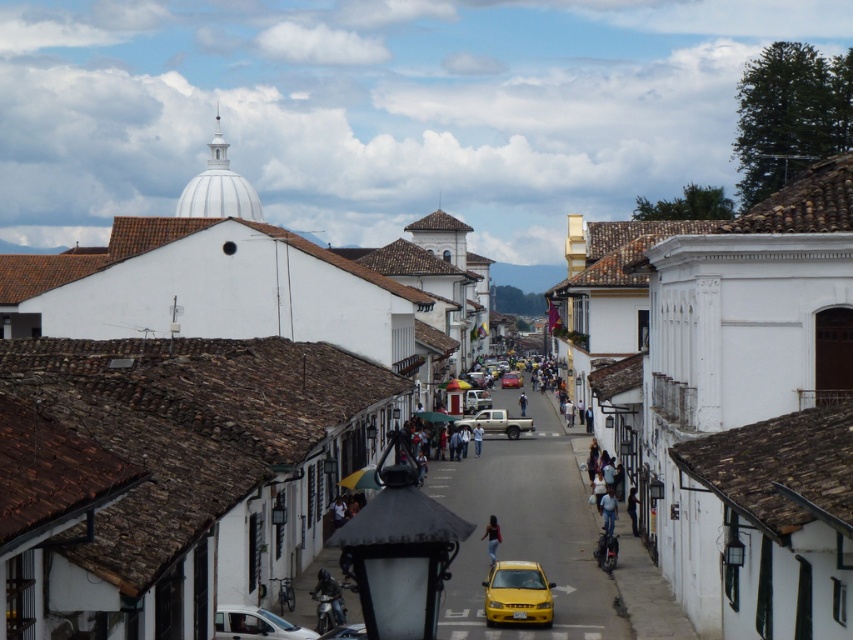
Is yellow matte taxi at center wider than light blue jeans at center?

Correct, the width of yellow matte taxi at center exceeds that of light blue jeans at center.

Who is more distant from viewer, (x=496, y=602) or (x=477, y=433)?

The point (x=477, y=433) is more distant.

This screenshot has width=853, height=640. Find the location of `yellow matte taxi at center`. yellow matte taxi at center is located at coordinates (517, 593).

Who is positioned more to the right, denim jeans at center or dark blue jeans at center?

dark blue jeans at center is more to the right.

Does denim jeans at center come behind dark blue jeans at center?

No.

Between point (492, 532) and point (634, 502), which one is positioned in front?

Point (492, 532)

Identify the location of denim jeans at center. Image resolution: width=853 pixels, height=640 pixels. (492, 538).

The image size is (853, 640). What are the coordinates of `silver metallic pickup truck at center` in the screenshot? It's located at (496, 422).

Does silver metallic pickup truck at center have a greater height compared to denim jeans at center?

Correct, silver metallic pickup truck at center is much taller as denim jeans at center.

The height and width of the screenshot is (640, 853). I want to click on silver metallic pickup truck at center, so click(496, 422).